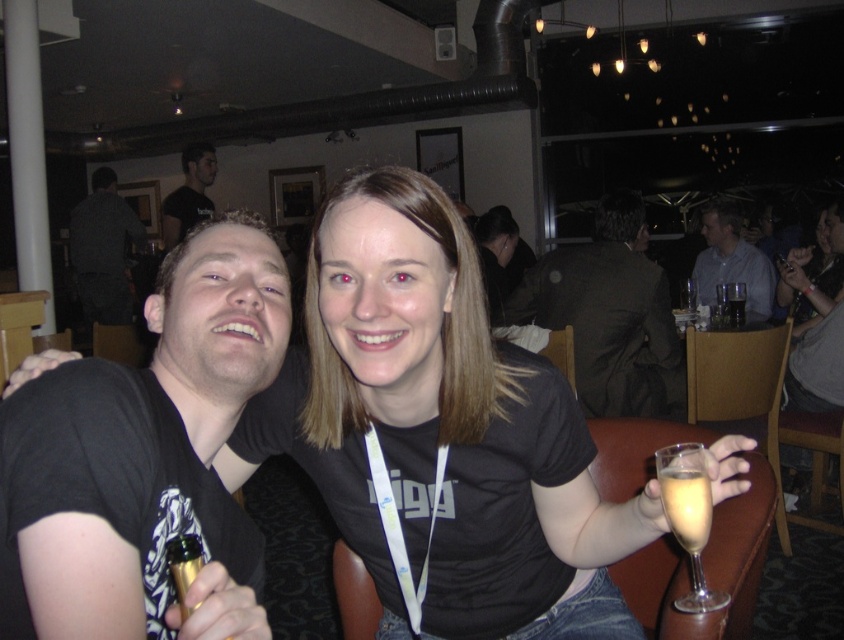
Question: Based on their relative distances, which object is nearer to the dark brown leather jacket at upper right?

Choices:
 (A) black fabric shirt at upper center
 (B) clear glass at right
 (C) gold metallic bottle at lower left
 (D) clear glass champagne flute at lower right

Answer: (A)

Question: Which of the following is the farthest from the observer?

Choices:
 (A) (310, 358)
 (B) (709, 252)
 (C) (661, 460)

Answer: (B)

Question: Is dark brown leather jacket at upper right behind clear glass champagne flute at lower right?

Choices:
 (A) no
 (B) yes

Answer: (B)

Question: Can you confirm if dark brown leather jacket at upper right is positioned to the left of black t-shirt at upper left?

Choices:
 (A) no
 (B) yes

Answer: (A)

Question: Can you confirm if black matte shirt at center is positioned below gold metallic bottle at lower left?

Choices:
 (A) no
 (B) yes

Answer: (A)

Question: Which point appears closest to the camera in this image?

Choices:
 (A) (705, 483)
 (B) (828, 356)
 (C) (452, 307)

Answer: (A)